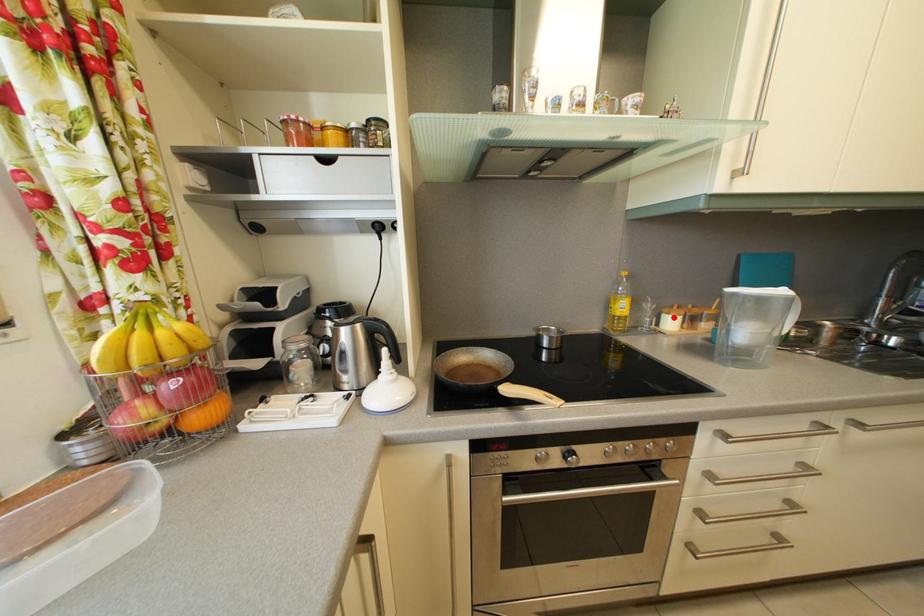
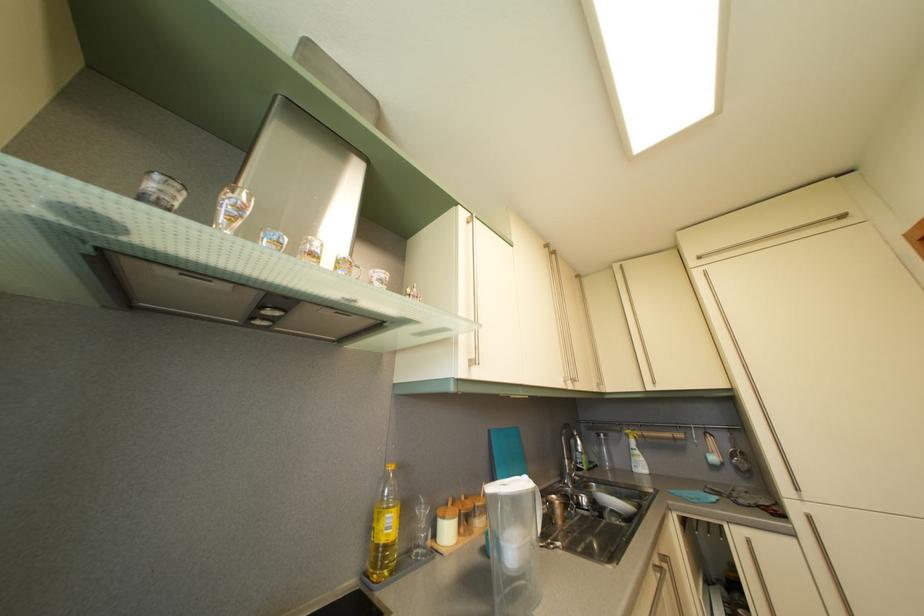
In the second image, find the point that corresponds to the highlighted location in the first image.

(448, 519)